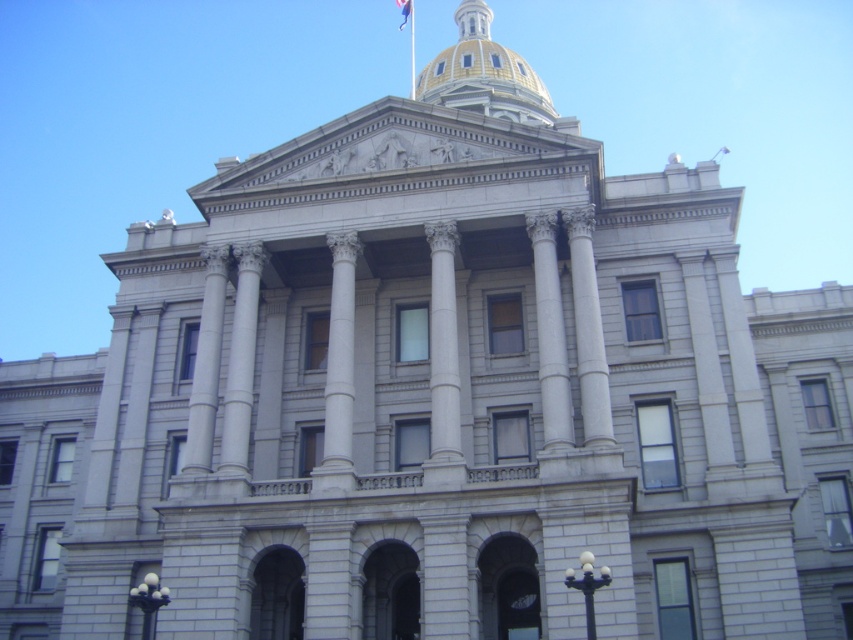
Who is positioned more to the right, gold/golden dome at upper center or metallic flag pole at upper center?

gold/golden dome at upper center

Does gold/golden dome at upper center have a lesser width compared to metallic flag pole at upper center?

Incorrect, gold/golden dome at upper center's width is not less than metallic flag pole at upper center's.

Between point (457, 92) and point (409, 93), which one is positioned behind?

The point (409, 93) is more distant.

The width and height of the screenshot is (853, 640). Identify the location of gold/golden dome at upper center. (485, 74).

The height and width of the screenshot is (640, 853). What are the coordinates of `metallic flag pole at upper center` in the screenshot? It's located at (410, 45).

Is metallic flag pole at upper center further to camera compared to white fabric flag at upper center?

No, metallic flag pole at upper center is closer to the viewer.

What do you see at coordinates (410, 45) in the screenshot? I see `metallic flag pole at upper center` at bounding box center [410, 45].

Locate an element on the screen. This screenshot has height=640, width=853. metallic flag pole at upper center is located at coordinates (410, 45).

Which of these two, gold/golden dome at upper center or white fabric flag at upper center, stands shorter?

white fabric flag at upper center is shorter.

Does gold/golden dome at upper center appear under white fabric flag at upper center?

Correct, gold/golden dome at upper center is located below white fabric flag at upper center.

Find the location of a particular element. The image size is (853, 640). gold/golden dome at upper center is located at coordinates (485, 74).

Locate an element on the screen. The width and height of the screenshot is (853, 640). gold/golden dome at upper center is located at coordinates (485, 74).